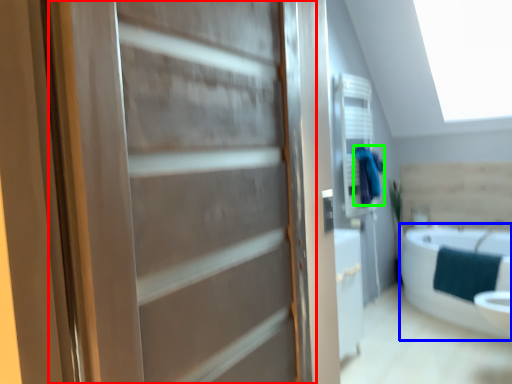
Question: Which is nearer to the door (highlighted by a red box)? bathtub (highlighted by a blue box) or bathrobe (highlighted by a green box).

Choices:
 (A) bathtub
 (B) bathrobe

Answer: (A)